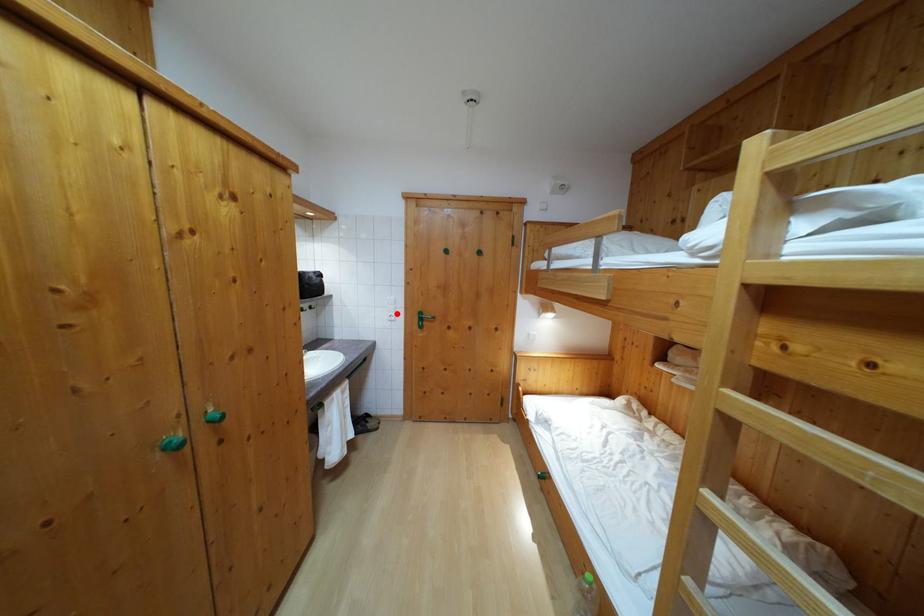
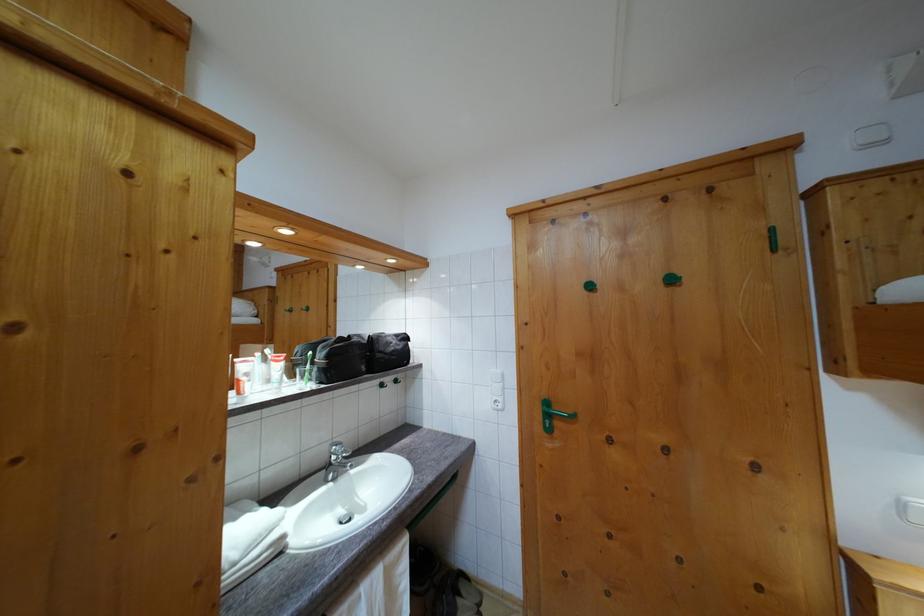
Question: I am providing you with two images of the same scene from different viewpoints. A red point is marked on the first image. Is the red point's position out of view in image 2?

Choices:
 (A) Yes
 (B) No

Answer: (B)